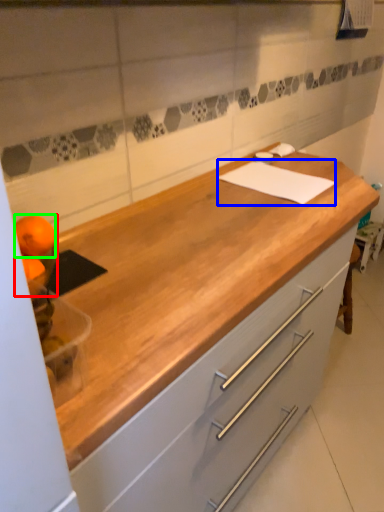
Question: Based on their relative distances, which object is nearer to orange (highlighted by a red box)? Choose from notepad (highlighted by a blue box) and orange (highlighted by a green box).

Choices:
 (A) notepad
 (B) orange

Answer: (B)